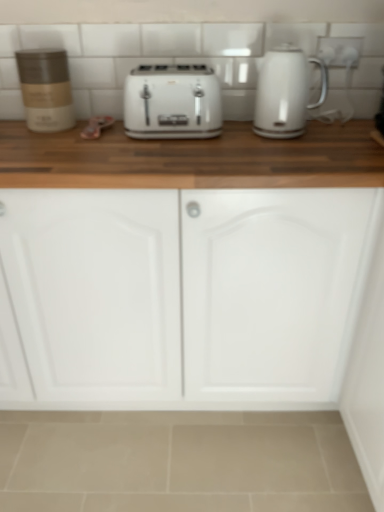
Find the location of a particular element. This screenshot has width=384, height=512. free space in front of white glossy electric kettle at upper right is located at coordinates (301, 151).